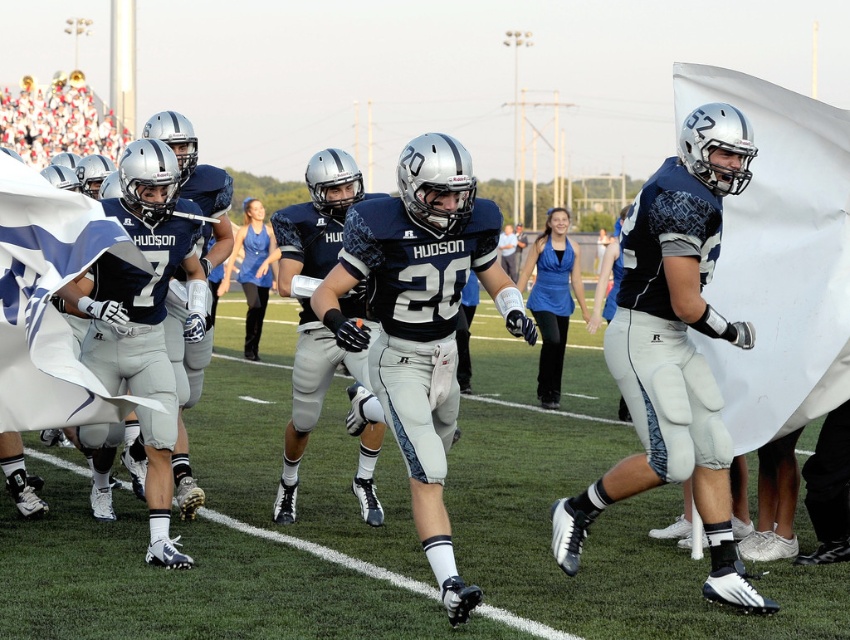
Between point (842, 115) and point (31, 211), which one is positioned in front?

Point (31, 211)

You are a GUI agent. You are given a task and a screenshot of the screen. Output one action in this format:
    pyautogui.click(x=<x>, y=<y>)
    Task: Click on the white fabric flag at right
    The width and height of the screenshot is (850, 640).
    Given the screenshot: What is the action you would take?
    (x=779, y=257)